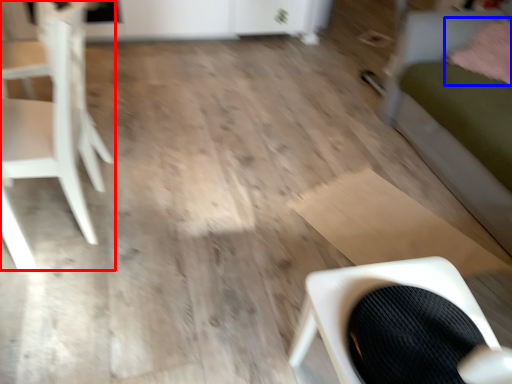
Question: Among these objects, which one is nearest to the camera, chair (highlighted by a red box) or pillow (highlighted by a blue box)?

Choices:
 (A) chair
 (B) pillow

Answer: (A)